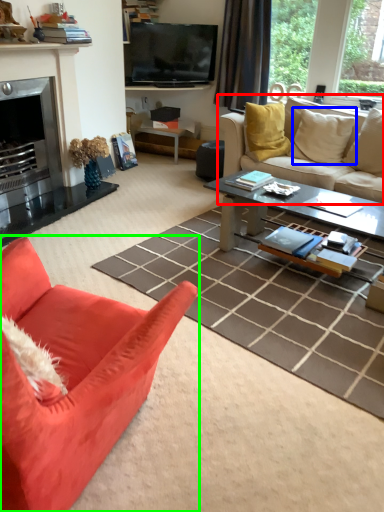
Question: Which object is positioned closest to studio couch (highlighted by a red box)? Select from pillow (highlighted by a blue box) and studio couch (highlighted by a green box).

Choices:
 (A) pillow
 (B) studio couch

Answer: (A)